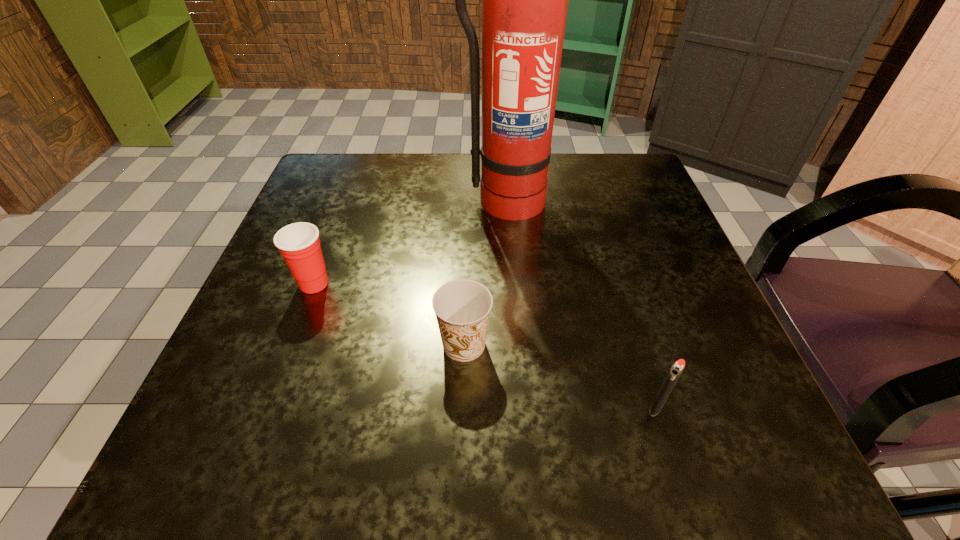
What are the coordinates of `free point between the farther Dixie cup and the nearest object` in the screenshot? It's located at (485, 345).

What are the coordinates of `vacant point located between the farthest object and the second farthest object` in the screenshot? It's located at (409, 242).

I want to click on vacant region between the nearer Dixie cup and the left Dixie cup, so click(389, 314).

Choose which object is the nearest neighbor to the igniter. Please provide its 2D coordinates. Your answer should be formatted as a tuple, i.e. [(x, y)], where the tuple contains the x and y coordinates of a point satisfying the conditions above.

[(462, 307)]

The image size is (960, 540). Find the location of `the closest object to the fire extinguisher`. the closest object to the fire extinguisher is located at coordinates (299, 244).

At what (x,y) coordinates should I click in order to perform the action: click on vacant space that satisfies the following two spatial constraints: 1. on the label side of the farthest object; 2. on the right side of the nearest object. Please return your answer as a coordinate pair (x, y). This screenshot has height=540, width=960. Looking at the image, I should click on (517, 407).

What are the coordinates of `free space that satisfies the following two spatial constraints: 1. on the front side of the nearer Dixie cup; 2. on the right side of the third nearest object` in the screenshot? It's located at (291, 345).

At what (x,y) coordinates should I click in order to perform the action: click on vacant position in the image that satisfies the following two spatial constraints: 1. on the front side of the rightmost object; 2. on the right side of the nearer Dixie cup. Please return your answer as a coordinate pair (x, y). This screenshot has width=960, height=540. Looking at the image, I should click on (462, 407).

Identify the location of vacant area that satisfies the following two spatial constraints: 1. on the front side of the igniter; 2. on the left side of the nearer Dixie cup. pos(462,407).